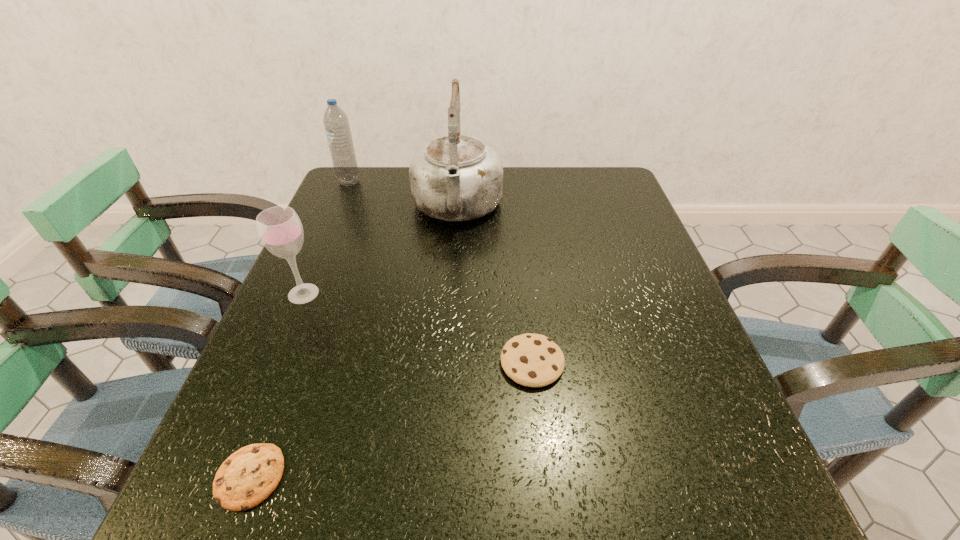
Identify the location of kettle. click(454, 178).

The height and width of the screenshot is (540, 960). Find the location of `water bottle`. water bottle is located at coordinates (336, 123).

Image resolution: width=960 pixels, height=540 pixels. What are the coordinates of `the third farthest object` in the screenshot? It's located at (280, 230).

Image resolution: width=960 pixels, height=540 pixels. I want to click on the third tallest object, so click(280, 230).

You are a GUI agent. You are given a task and a screenshot of the screen. Output one action in this format:
    pyautogui.click(x=<x>, y=<y>)
    Task: Click on the taller cookie
    This screenshot has height=540, width=960.
    Given the screenshot: What is the action you would take?
    pyautogui.click(x=533, y=360)

What are the coordinates of `the second shortest object` in the screenshot? It's located at (533, 360).

Identify the location of the shorter cookie. (247, 477).

Identify the location of the nearest object. (247, 477).

At what (x,y) coordinates should I click in order to perform the action: click on vacant space located at the spout of the tallest object. Please return your answer as a coordinate pair (x, y). This screenshot has width=960, height=540. Looking at the image, I should click on (451, 301).

Image resolution: width=960 pixels, height=540 pixels. What are the coordinates of `vacant position located on the front of the water bottle` in the screenshot? It's located at (329, 229).